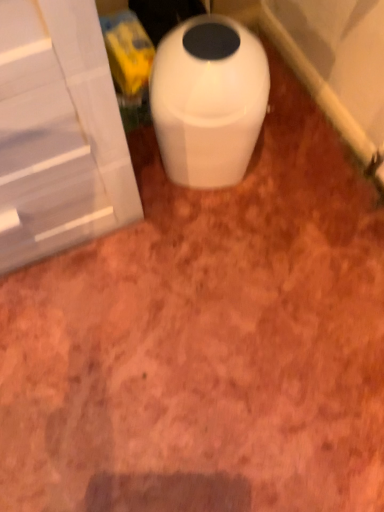
This screenshot has width=384, height=512. In order to click on vacant area that is situated to the right of white glossy trash can at center in this screenshot , I will do (288, 165).